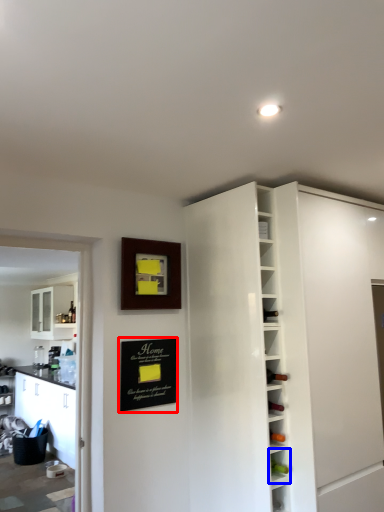
Question: Which point is closer to the camera, bulletin board (highlighted by a red box) or shelf (highlighted by a blue box)?

Choices:
 (A) bulletin board
 (B) shelf

Answer: (B)